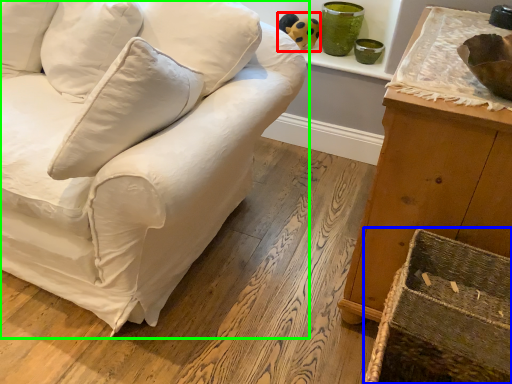
Question: Estimate the real-world distances between objects in this image. Which object is farther from toy (highlighted by a red box), crate (highlighted by a blue box) or studio couch (highlighted by a green box)?

Choices:
 (A) crate
 (B) studio couch

Answer: (A)